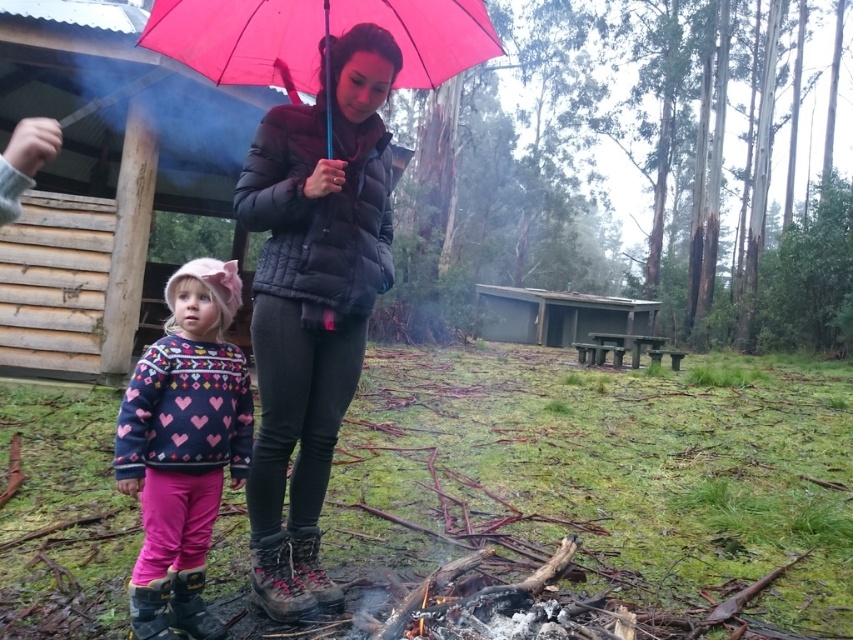
Question: Does matte black puffer jacket at center appear over dark blue fleece sweater with hearts at lower left?

Choices:
 (A) yes
 (B) no

Answer: (A)

Question: Which of the following is the closest to the observer?

Choices:
 (A) (193, 332)
 (B) (321, 396)

Answer: (A)

Question: Can you confirm if matte black puffer jacket at center is bigger than pink matte umbrella at upper center?

Choices:
 (A) yes
 (B) no

Answer: (A)

Question: In this image, where is dark blue fleece sweater with hearts at lower left located relative to pink matte umbrella at upper center?

Choices:
 (A) left
 (B) right

Answer: (A)

Question: Which object appears closest to the camera in this image?

Choices:
 (A) pink matte umbrella at upper center
 (B) matte black puffer jacket at center
 (C) dark blue fleece sweater with hearts at lower left

Answer: (C)

Question: Which of the following is the farthest from the observer?

Choices:
 (A) pink matte umbrella at upper center
 (B) matte black puffer jacket at center
 (C) dark blue fleece sweater with hearts at lower left

Answer: (A)